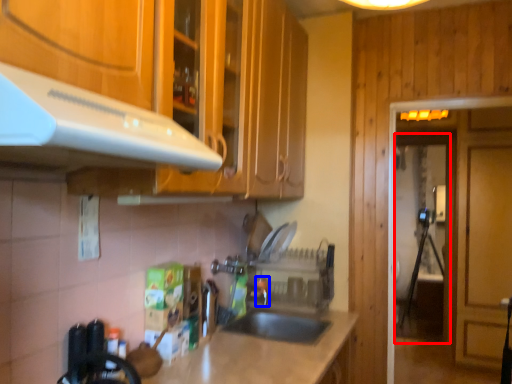
Question: Which point is closer to the camera, glass door (highlighted by a red box) or faucet (highlighted by a blue box)?

Choices:
 (A) glass door
 (B) faucet

Answer: (B)